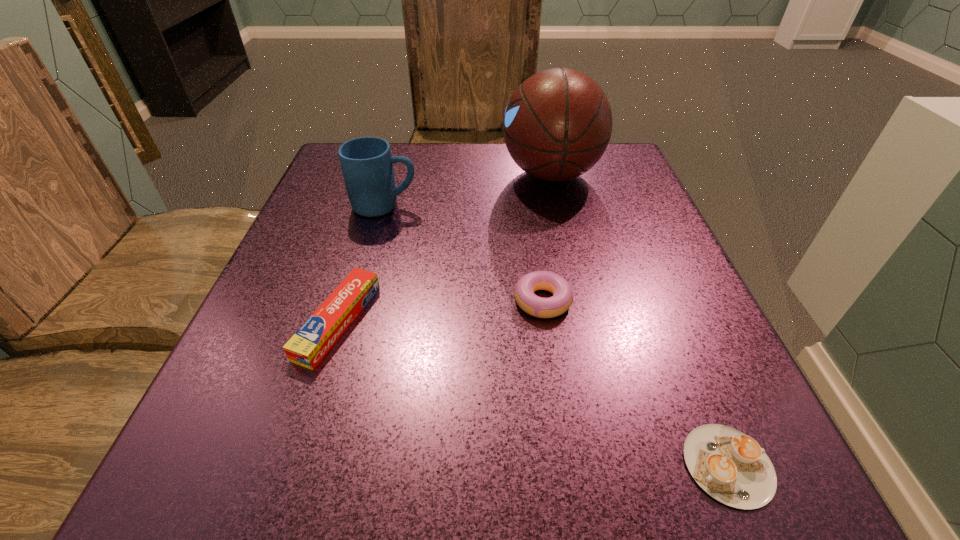
Locate an element on the screen. This screenshot has width=960, height=540. vacant region that satisfies the following two spatial constraints: 1. on the side of the second tallest object with the handle; 2. on the left side of the nearest object is located at coordinates (313, 465).

The height and width of the screenshot is (540, 960). In order to click on vacant position in the image that satisfies the following two spatial constraints: 1. on the back side of the doughnut; 2. on the side of the mug with the handle in this screenshot , I will do `click(529, 206)`.